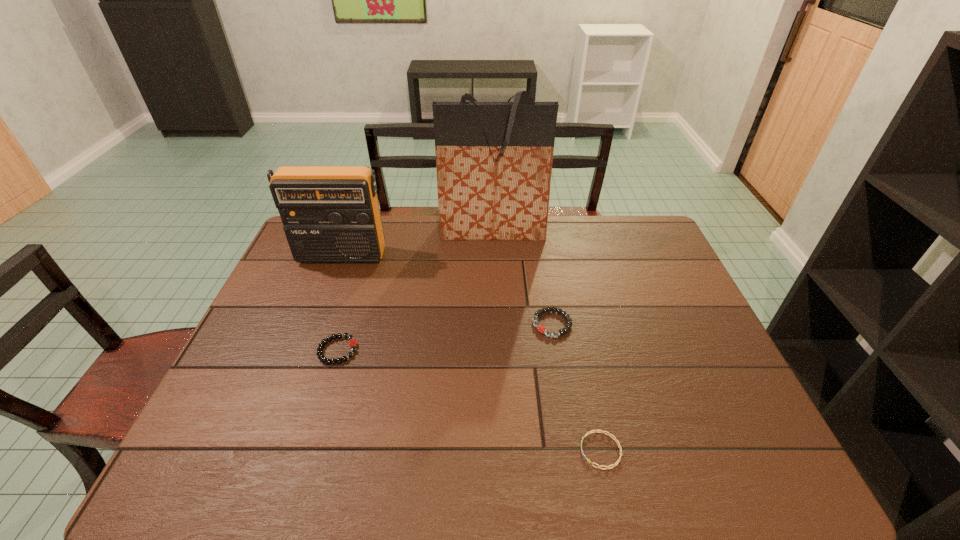
The height and width of the screenshot is (540, 960). Identify the location of free space located on the surface of the nearest bracelet showing star-shaped elements. (495, 450).

Locate an element on the screen. The width and height of the screenshot is (960, 540). shopping bag positioned at the far edge is located at coordinates (494, 160).

Locate an element on the screen. radio receiver present at the far edge is located at coordinates (330, 214).

The height and width of the screenshot is (540, 960). I want to click on object located at the near edge, so click(x=613, y=465).

Identify the location of object situated at the left edge. This screenshot has width=960, height=540. (330, 214).

Where is `object located at the far left corner`? This screenshot has height=540, width=960. object located at the far left corner is located at coordinates (330, 214).

Locate an element on the screen. Image resolution: width=960 pixels, height=540 pixels. free space at the far edge is located at coordinates (405, 230).

The height and width of the screenshot is (540, 960). I want to click on vacant space at the near edge, so (x=295, y=451).

Find the location of `free spot at the left edge of the desktop`. free spot at the left edge of the desktop is located at coordinates (214, 409).

Locate an element on the screen. The height and width of the screenshot is (540, 960). vacant space at the right edge of the desktop is located at coordinates (676, 386).